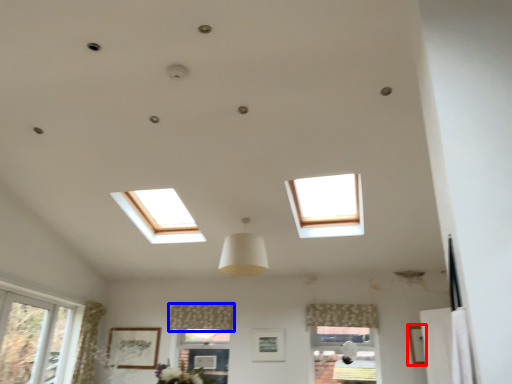
Question: Which object is closer to the camera taking this photo, picture frame (highlighted by a red box) or curtain (highlighted by a blue box)?

Choices:
 (A) picture frame
 (B) curtain

Answer: (A)